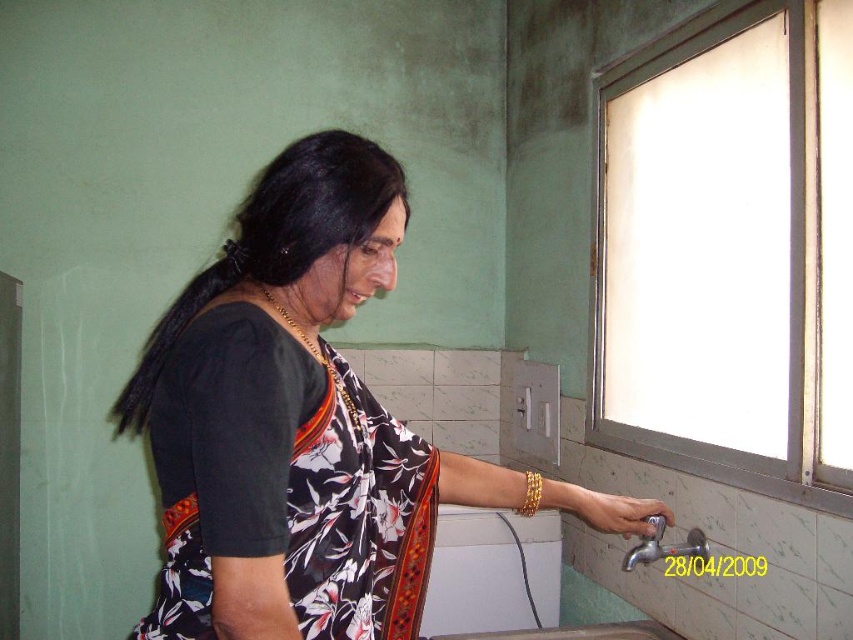
Question: Which point appears farthest from the camera in this image?

Choices:
 (A) (599, 515)
 (B) (194, 465)
 (C) (646, 560)

Answer: (C)

Question: Which point is farther to the camera?

Choices:
 (A) (358, 595)
 (B) (373, 586)

Answer: (B)

Question: Does black floral saree at center have a smaller size compared to silver metallic faucet at lower right?

Choices:
 (A) no
 (B) yes

Answer: (A)

Question: Can you confirm if black floral saree at center is smaller than white glossy sink at lower right?

Choices:
 (A) yes
 (B) no

Answer: (B)

Question: Which object is closer to the camera taking this photo?

Choices:
 (A) gold metallic bracelet at lower right
 (B) silver metallic faucet at lower right

Answer: (A)

Question: Can you confirm if black floral fabric sari at center is positioned to the right of white glossy sink at lower right?

Choices:
 (A) no
 (B) yes

Answer: (A)